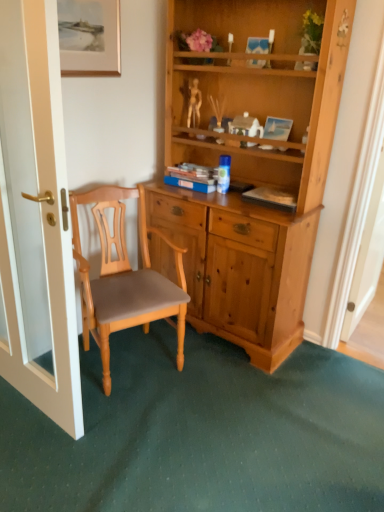
Locate an element on the screen. The width and height of the screenshot is (384, 512). blank area beneath light brown wood chair at center (from a real-world perspective) is located at coordinates (136, 374).